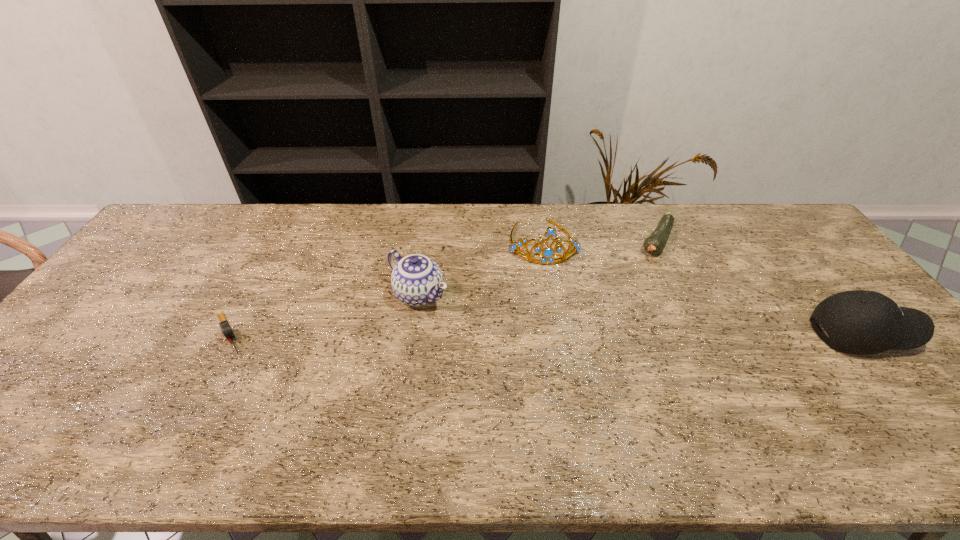
Find the location of a particular element. Image resolution: width=960 pixels, height=540 pixels. tape measure is located at coordinates (226, 330).

Where is `the shortest object`? Image resolution: width=960 pixels, height=540 pixels. the shortest object is located at coordinates (226, 330).

Where is `baseball cap`? The height and width of the screenshot is (540, 960). baseball cap is located at coordinates (859, 322).

The height and width of the screenshot is (540, 960). Find the location of `the second object from left to right`. the second object from left to right is located at coordinates (416, 280).

Image resolution: width=960 pixels, height=540 pixels. I want to click on the fourth object from left to right, so click(x=656, y=241).

At what (x,y) coordinates should I click in order to perform the action: click on zucchini. Please return your answer as a coordinate pair (x, y). Looking at the image, I should click on (656, 241).

Find the location of a particular element. the third object from left to right is located at coordinates (547, 255).

Identify the location of free location located on the left of the tape measure. (94, 334).

At what (x,y) coordinates should I click in order to perform the action: click on free space located at the spout of the fourth object from right to left. Please return your answer as a coordinate pair (x, y). Looking at the image, I should click on (492, 346).

Where is `blank area located at the spout of the fourth object from right to left`? blank area located at the spout of the fourth object from right to left is located at coordinates (532, 374).